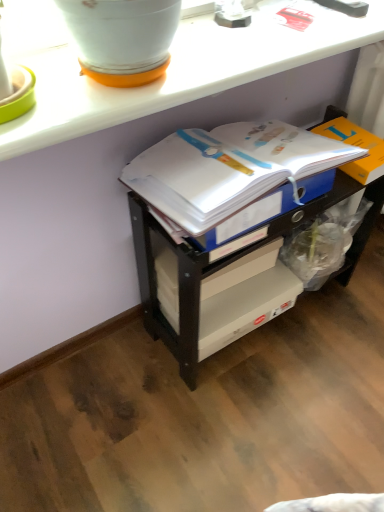
Question: Is white paper journal at center at the right side of white glossy counter at upper center?

Choices:
 (A) yes
 (B) no

Answer: (A)

Question: Considering the relative sizes of white paper journal at center and white glossy counter at upper center in the image provided, is white paper journal at center taller than white glossy counter at upper center?

Choices:
 (A) no
 (B) yes

Answer: (B)

Question: Is white paper journal at center positioned before white glossy counter at upper center?

Choices:
 (A) no
 (B) yes

Answer: (A)

Question: Does white paper journal at center come behind white glossy counter at upper center?

Choices:
 (A) no
 (B) yes

Answer: (B)

Question: From a real-world perspective, is white paper journal at center under white glossy counter at upper center?

Choices:
 (A) no
 (B) yes

Answer: (B)

Question: Looking at the image, does orange cardboard box at right seem bigger or smaller compared to white glossy flowerpot at upper left?

Choices:
 (A) big
 (B) small

Answer: (B)

Question: Is orange cardboard box at right spatially inside white glossy flowerpot at upper left, or outside of it?

Choices:
 (A) outside
 (B) inside

Answer: (A)

Question: Considering the relative positions of orange cardboard box at right and white glossy flowerpot at upper left in the image provided, is orange cardboard box at right to the left or to the right of white glossy flowerpot at upper left?

Choices:
 (A) left
 (B) right

Answer: (B)

Question: In terms of height, does orange cardboard box at right look taller or shorter compared to white glossy flowerpot at upper left?

Choices:
 (A) short
 (B) tall

Answer: (A)

Question: Is orange cardboard box at right wider or thinner than white glossy counter at upper center?

Choices:
 (A) wide
 (B) thin

Answer: (B)

Question: From a real-world perspective, is orange cardboard box at right above or below white glossy counter at upper center?

Choices:
 (A) below
 (B) above

Answer: (A)

Question: Based on their sizes in the image, would you say orange cardboard box at right is bigger or smaller than white glossy counter at upper center?

Choices:
 (A) small
 (B) big

Answer: (A)

Question: Do you think orange cardboard box at right is within white glossy counter at upper center, or outside of it?

Choices:
 (A) outside
 (B) inside

Answer: (A)

Question: Considering the positions of white paper journal at center and white glossy flowerpot at upper left in the image, is white paper journal at center taller or shorter than white glossy flowerpot at upper left?

Choices:
 (A) short
 (B) tall

Answer: (A)

Question: Is point (158, 195) positioned closer to the camera than point (97, 49)?

Choices:
 (A) closer
 (B) farther

Answer: (B)